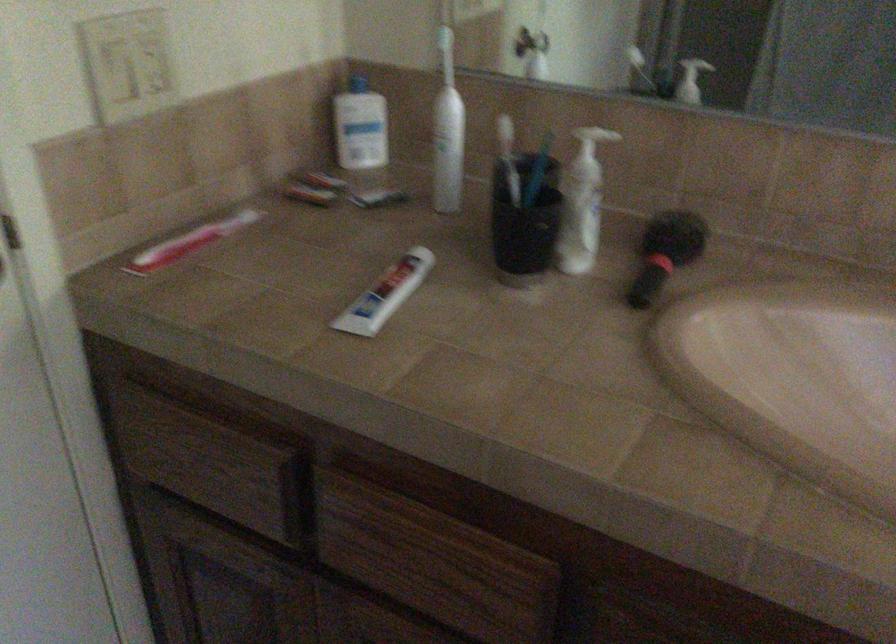
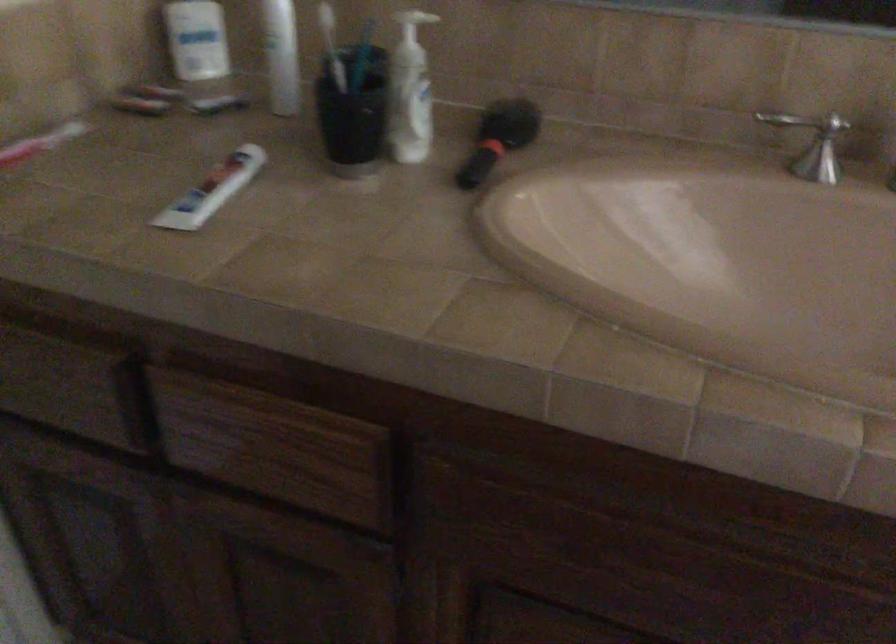
Where in the second image is the point corresponding to pixel 506 527 from the first image?

(341, 404)